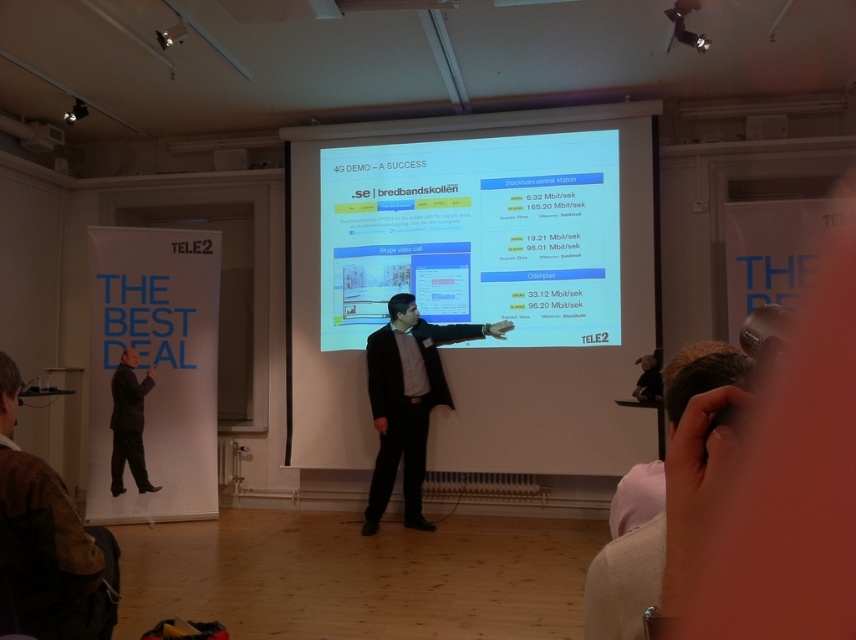
Question: Which object is the farthest from the dark suit at left?

Choices:
 (A) matte white projector screen at center
 (B) white paperboard at left
 (C) brown wool sweater at lower left

Answer: (C)

Question: Based on their relative distances, which object is nearer to the white paperboard at left?

Choices:
 (A) brown wool sweater at lower left
 (B) matte white projector screen at center
 (C) black suit at center

Answer: (B)

Question: Can you confirm if matte white projector screen at center is thinner than white glossy projector screen at center?

Choices:
 (A) no
 (B) yes

Answer: (A)

Question: Which object appears closest to the camera in this image?

Choices:
 (A) matte white projector screen at center
 (B) white glossy projector screen at center
 (C) dark suit at left
 (D) black suit at center

Answer: (D)

Question: Does white glossy projector screen at center appear over dark suit at left?

Choices:
 (A) yes
 (B) no

Answer: (A)

Question: Is matte white projector screen at center bigger than black suit at center?

Choices:
 (A) yes
 (B) no

Answer: (A)